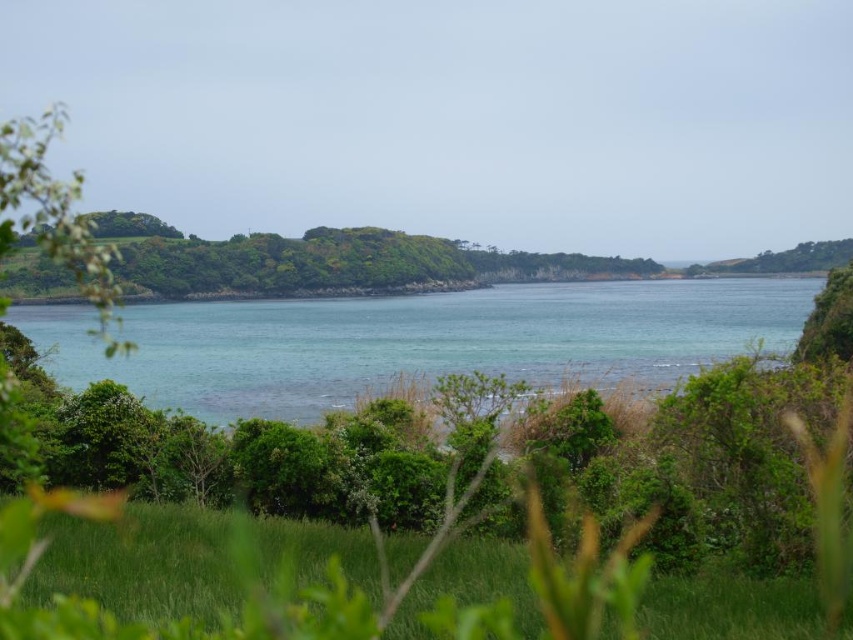
Question: Which point is closer to the camera?

Choices:
 (A) green grassy at lower center
 (B) clear blue water at center

Answer: (A)

Question: From the image, what is the correct spatial relationship of clear blue water at center in relation to green grassy at lower center?

Choices:
 (A) right
 (B) left

Answer: (B)

Question: Is clear blue water at center positioned before green grassy at lower center?

Choices:
 (A) yes
 (B) no

Answer: (B)

Question: Which point is closer to the camera?

Choices:
 (A) clear blue water at center
 (B) green grassy at lower center

Answer: (B)

Question: In this image, where is clear blue water at center located relative to green grassy at lower center?

Choices:
 (A) left
 (B) right

Answer: (A)

Question: Which point appears farthest from the camera in this image?

Choices:
 (A) [184, 628]
 (B) [704, 282]

Answer: (B)